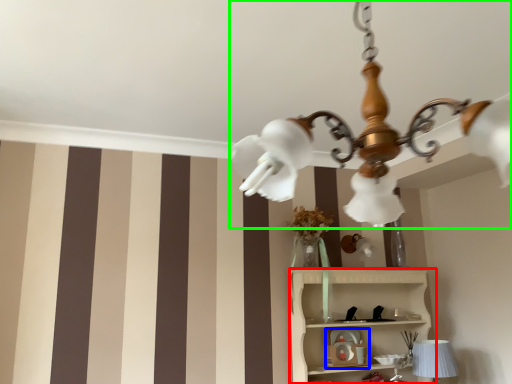
Question: Which object is positioned farthest from shelf (highlighted by a red box)? Select from toy (highlighted by a blue box) and lamp (highlighted by a green box).

Choices:
 (A) toy
 (B) lamp

Answer: (B)